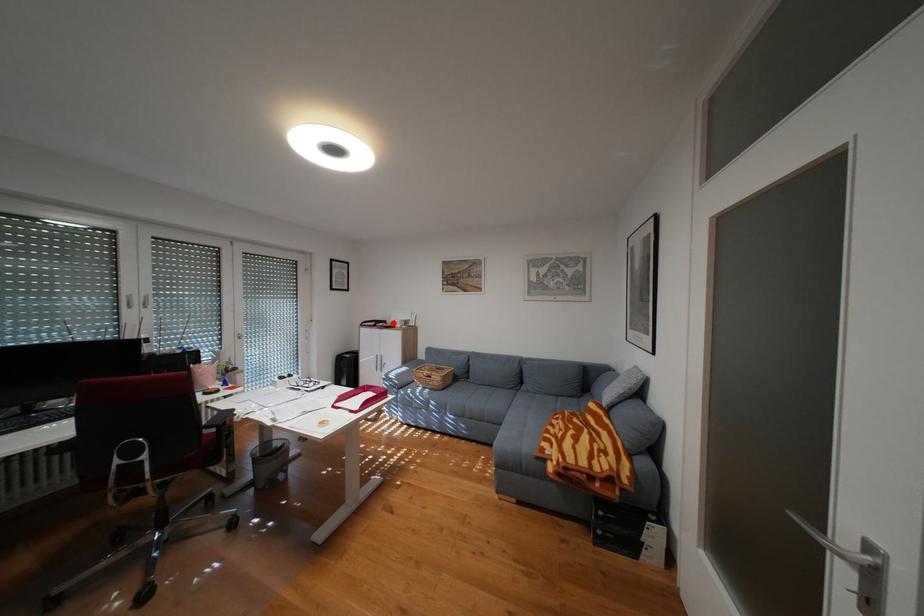
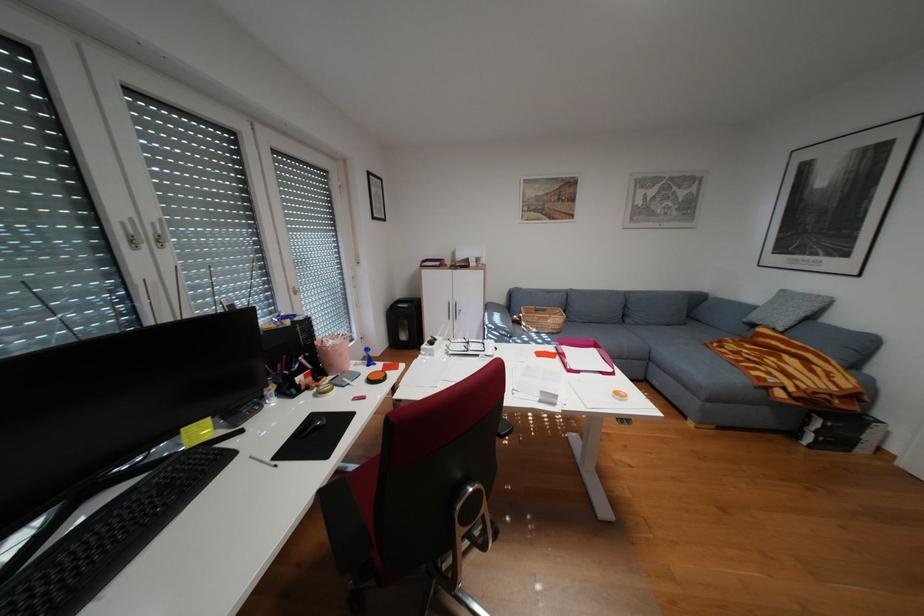
Question: I am providing you with two images of the same scene from different viewpoints. A red point is marked on the first image. Is the red point's position out of view in image 2?

Choices:
 (A) Yes
 (B) No

Answer: (B)